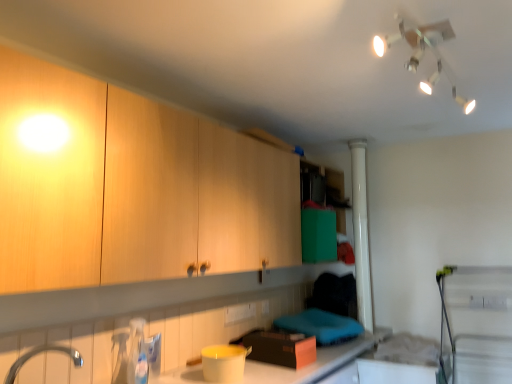
Question: Is the depth of silver metallic tap at lower left greater than that of matte plastic container at lower center?

Choices:
 (A) no
 (B) yes

Answer: (A)

Question: From the image's perspective, is silver metallic tap at lower left on top of matte plastic container at lower center?

Choices:
 (A) yes
 (B) no

Answer: (A)

Question: Does silver metallic tap at lower left lie in front of matte plastic container at lower center?

Choices:
 (A) yes
 (B) no

Answer: (A)

Question: Does silver metallic tap at lower left have a larger size compared to matte plastic container at lower center?

Choices:
 (A) no
 (B) yes

Answer: (A)

Question: From a real-world perspective, is silver metallic tap at lower left over matte plastic container at lower center?

Choices:
 (A) yes
 (B) no

Answer: (A)

Question: Does point (401, 34) appear closer or farther from the camera than point (22, 359)?

Choices:
 (A) closer
 (B) farther

Answer: (A)

Question: From the image's perspective, is white plastic light fixture at upper center positioned above or below silver metallic tap at lower left?

Choices:
 (A) below
 (B) above

Answer: (B)

Question: In terms of width, does white plastic light fixture at upper center look wider or thinner when compared to silver metallic tap at lower left?

Choices:
 (A) thin
 (B) wide

Answer: (B)

Question: From a real-world perspective, relative to silver metallic tap at lower left, is white plastic light fixture at upper center vertically above or below?

Choices:
 (A) below
 (B) above

Answer: (B)

Question: From a real-world perspective, is silver metallic tap at lower left physically located above or below matte plastic container at lower center?

Choices:
 (A) above
 (B) below

Answer: (A)

Question: Is silver metallic tap at lower left bigger or smaller than matte plastic container at lower center?

Choices:
 (A) small
 (B) big

Answer: (A)

Question: Is silver metallic tap at lower left spatially inside matte plastic container at lower center, or outside of it?

Choices:
 (A) outside
 (B) inside

Answer: (A)

Question: Is silver metallic tap at lower left taller or shorter than matte plastic container at lower center?

Choices:
 (A) short
 (B) tall

Answer: (A)

Question: Based on their sizes in the image, would you say matte plastic container at lower center is bigger or smaller than white plastic light fixture at upper center?

Choices:
 (A) big
 (B) small

Answer: (A)

Question: Is matte plastic container at lower center inside or outside of white plastic light fixture at upper center?

Choices:
 (A) outside
 (B) inside

Answer: (A)